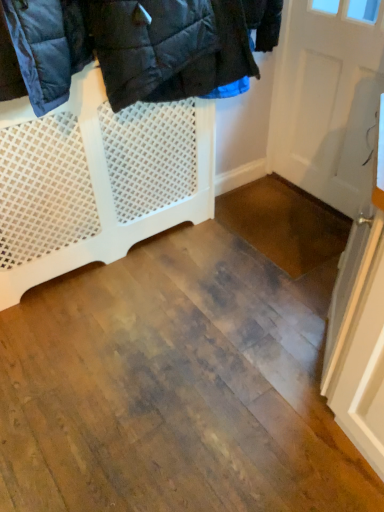
This screenshot has height=512, width=384. What are the coordinates of `white mesh gate at upper left` in the screenshot? It's located at (96, 180).

What do you see at coordinates (96, 180) in the screenshot? I see `white mesh gate at upper left` at bounding box center [96, 180].

What do you see at coordinates (325, 101) in the screenshot? I see `white matte door at upper right` at bounding box center [325, 101].

Consider the image. What is the approximate width of white matte door at upper right?

6.58 centimeters.

You are a GUI agent. You are given a task and a screenshot of the screen. Output one action in this format:
    pyautogui.click(x=<x>, y=<y>)
    Task: Click on the white matte door at upper right
    
    Given the screenshot: What is the action you would take?
    pyautogui.click(x=325, y=101)

The image size is (384, 512). In order to click on white mesh gate at upper left in this screenshot , I will do `click(96, 180)`.

Which object is positioned more to the left, white matte door at upper right or white mesh gate at upper left?

white mesh gate at upper left is more to the left.

In the scene shown: Considering their positions, is white matte door at upper right located in front of or behind white mesh gate at upper left?

white matte door at upper right is positioned farther from the viewer than white mesh gate at upper left.

Which is closer to the camera, (318, 105) or (181, 163)?

Point (318, 105).

Consider the image. From the image's perspective, between white matte door at upper right and white mesh gate at upper left, who is located below?

white mesh gate at upper left, from the image's perspective.

From a real-world perspective, which object stands above the other?

white matte door at upper right, from a real-world perspective.

Between white matte door at upper right and white mesh gate at upper left, which one has larger width?

white mesh gate at upper left.

Considering the relative sizes of white matte door at upper right and white mesh gate at upper left in the image provided, is white matte door at upper right taller than white mesh gate at upper left?

Yes.

Considering the sizes of white matte door at upper right and white mesh gate at upper left in the image, is white matte door at upper right bigger or smaller than white mesh gate at upper left?

In the image, white matte door at upper right appears to be smaller than white mesh gate at upper left.

Is white matte door at upper right situated inside white mesh gate at upper left or outside?

white matte door at upper right exists outside the volume of white mesh gate at upper left.

Would you consider white matte door at upper right to be distant from white mesh gate at upper left?

They are positioned close to each other.

Is white matte door at upper right looking in the opposite direction of white mesh gate at upper left?

white matte door at upper right does not have its back to white mesh gate at upper left.

Can you tell me how much white matte door at upper right and white mesh gate at upper left differ in facing direction?

90 degrees.

Where is `door that appears above the white mesh gate at upper left (from a real-world perspective)`? Image resolution: width=384 pixels, height=512 pixels. door that appears above the white mesh gate at upper left (from a real-world perspective) is located at coordinates pos(325,101).

Considering the relative positions of white mesh gate at upper left and white matte door at upper right in the image provided, is white mesh gate at upper left to the right of white matte door at upper right from the viewer's perspective?

Incorrect, white mesh gate at upper left is not on the right side of white matte door at upper right.

Is the depth of white mesh gate at upper left greater than that of white matte door at upper right?

No, white mesh gate at upper left is closer to the viewer.

Is point (71, 208) positioned before point (316, 45)?

Yes, it is.

From the image's perspective, which one is positioned higher, white mesh gate at upper left or white matte door at upper right?

white matte door at upper right appears higher in the image.

From a real-world perspective, is white mesh gate at upper left above or below white matte door at upper right?

From a real-world perspective, white mesh gate at upper left is physically below white matte door at upper right.

Between white mesh gate at upper left and white matte door at upper right, which one has smaller width?

white matte door at upper right is thinner.

Does white mesh gate at upper left have a greater height compared to white matte door at upper right?

Incorrect, the height of white mesh gate at upper left is not larger of that of white matte door at upper right.

Who is smaller, white mesh gate at upper left or white matte door at upper right?

Smaller between the two is white matte door at upper right.

From the picture: Is white mesh gate at upper left inside the boundaries of white matte door at upper right, or outside?

white mesh gate at upper left exists outside the volume of white matte door at upper right.

Is white mesh gate at upper left far away from white matte door at upper right?

That's not correct — white mesh gate at upper left is a little close to white matte door at upper right.

Does white mesh gate at upper left turn towards white matte door at upper right?

No, white mesh gate at upper left is not turned towards white matte door at upper right.

How many degrees apart are the facing directions of white mesh gate at upper left and white matte door at upper right?

The angle between the facing direction of white mesh gate at upper left and the facing direction of white matte door at upper right is 90 degrees.

You are a GUI agent. You are given a task and a screenshot of the screen. Output one action in this format:
    pyautogui.click(x=<x>, y=<y>)
    Task: Click on the door on the right side of white mesh gate at upper left
    This screenshot has height=512, width=384.
    Given the screenshot: What is the action you would take?
    pyautogui.click(x=325, y=101)

The height and width of the screenshot is (512, 384). I want to click on furniture below the white matte door at upper right (from a real-world perspective), so click(96, 180).

In order to click on furniture that appears on the left of white matte door at upper right in this screenshot , I will do `click(96, 180)`.